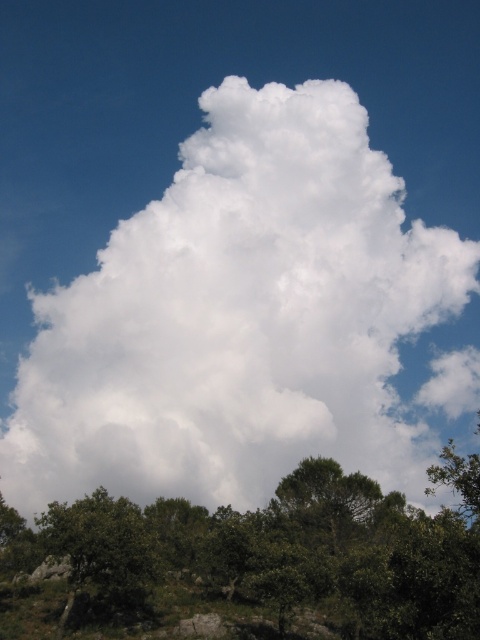
Question: From the image, what is the correct spatial relationship of green leafy tree at lower center in relation to green leafy tree at lower left?

Choices:
 (A) right
 (B) left

Answer: (A)

Question: Among these points, which one is farthest from the camera?

Choices:
 (A) click(x=332, y=484)
 (B) click(x=112, y=513)

Answer: (A)

Question: Which object is positioned farthest from the white fluffy cloud at center?

Choices:
 (A) green leafy tree at lower center
 (B) green leafy tree at lower left

Answer: (B)

Question: Which point is closer to the camera taking this photo?

Choices:
 (A) (93, 492)
 (B) (216, 182)

Answer: (A)

Question: Is white fluffy cloud at center closer to the viewer compared to green leafy tree at lower center?

Choices:
 (A) no
 (B) yes

Answer: (A)

Question: Does white fluffy cloud at center appear on the right side of green leafy tree at lower left?

Choices:
 (A) yes
 (B) no

Answer: (A)